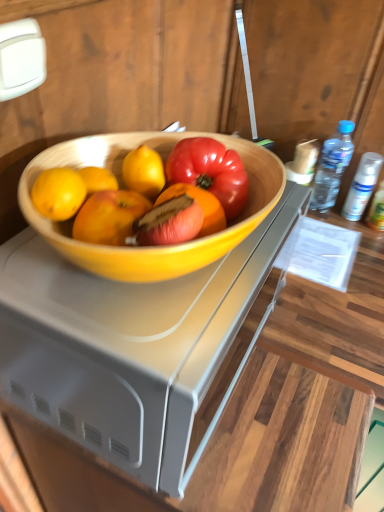
Locate an element on the screen. empty space that is to the right of wooden desk at center is located at coordinates (319, 352).